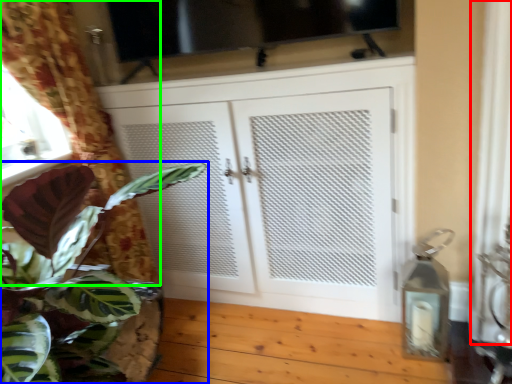
Question: Which object is positioned closest to curtain (highlighted by a red box)? Select from houseplant (highlighted by a blue box) and curtain (highlighted by a green box).

Choices:
 (A) houseplant
 (B) curtain

Answer: (A)